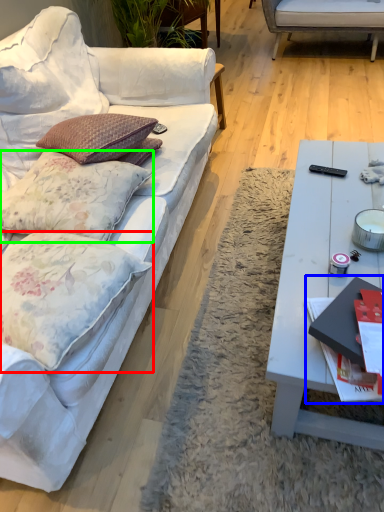
Question: Considering the real-world distances, which object is farthest from pillow (highlighted by a red box)? magazine (highlighted by a blue box) or pillow (highlighted by a green box)?

Choices:
 (A) magazine
 (B) pillow

Answer: (A)